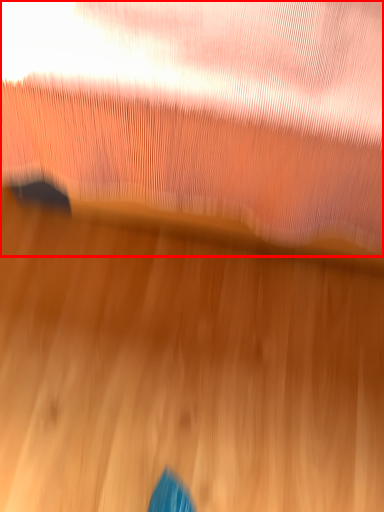
Question: From the image's perspective, what is the correct spatial relationship of curtain (annotated by the red box) in relation to wood?

Choices:
 (A) below
 (B) above

Answer: (B)